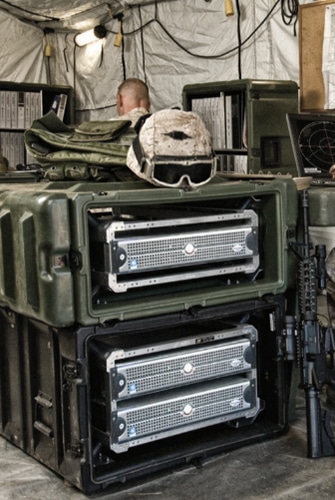
Identify the location of hanging light. This screenshot has height=500, width=335. (88, 37).